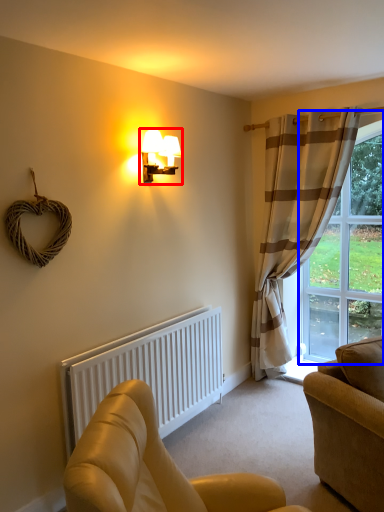
Question: Which of the following is the farthest to the observer, lamp (highlighted by a red box) or window (highlighted by a blue box)?

Choices:
 (A) lamp
 (B) window

Answer: (B)